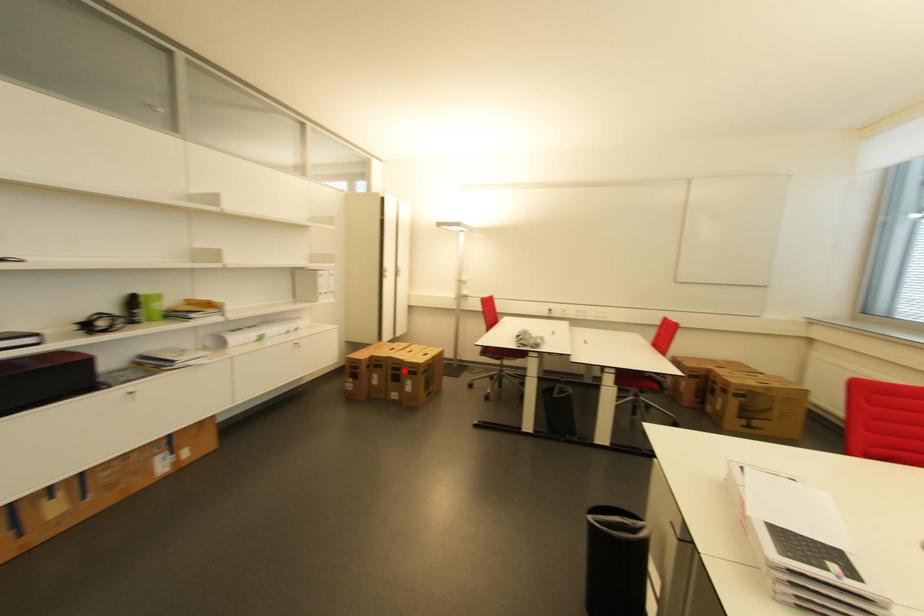
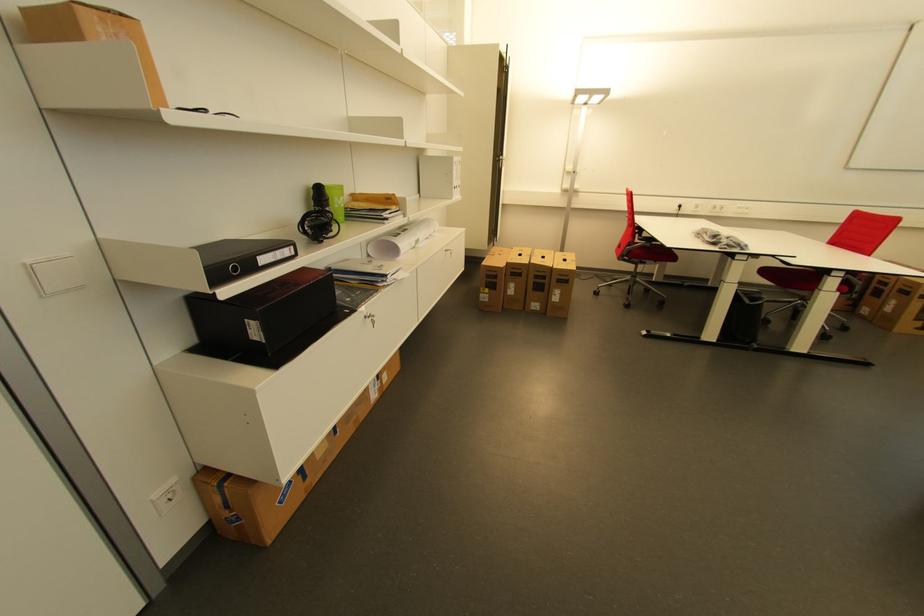
Where in the second image is the point corresponding to the highlighted location from the first image?

(550, 278)